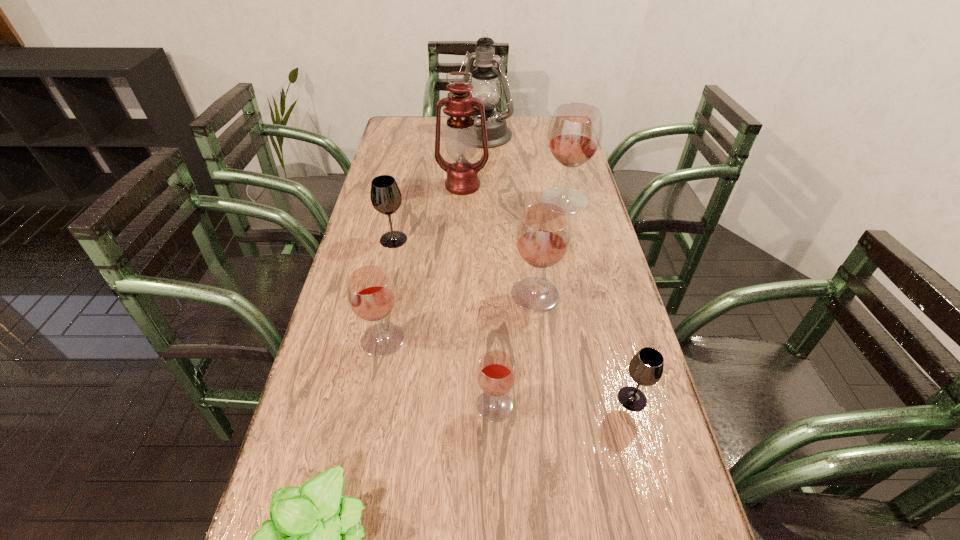
Identify the location of free space between the fifth shortest wineglass and the farthest object. (510, 215).

Find the location of `unoccupied position between the farthest object and the nearest red wineglass`. unoccupied position between the farthest object and the nearest red wineglass is located at coordinates (489, 271).

The image size is (960, 540). In order to click on vacant area between the farthest object and the fourth farthest object in this screenshot , I will do `click(439, 188)`.

This screenshot has height=540, width=960. I want to click on vacant region between the nearest red wineglass and the nearer oil lamp, so click(479, 295).

In order to click on the fourth closest object relative to the nearer gray wineglass in this screenshot , I will do (313, 539).

Select which object is the fifth closest to the seventh shortest object. Please provide its 2D coordinates. Your answer should be formatted as a tuple, i.e. [(x, y)], where the tuple contains the x and y coordinates of a point satisfying the conditions above.

[(371, 295)]

At what (x,y) coordinates should I click in order to perform the action: click on wineglass that stands as the fifth closest to the tallest wineglass. Please return your answer as a coordinate pair (x, y). Looking at the image, I should click on (496, 374).

Locate which wineglass is the second closest to the farther oil lamp. Please provide its 2D coordinates. Your answer should be formatted as a tuple, i.e. [(x, y)], where the tuple contains the x and y coordinates of a point satisfying the conditions above.

[(385, 195)]

Identify which red wineglass is located as the second nearest to the third biggest red wineglass. Please provide its 2D coordinates. Your answer should be formatted as a tuple, i.e. [(x, y)], where the tuple contains the x and y coordinates of a point satisfying the conditions above.

[(543, 234)]

Locate an element on the screen. The width and height of the screenshot is (960, 540). the closest red wineglass to the leftmost red wineglass is located at coordinates (496, 374).